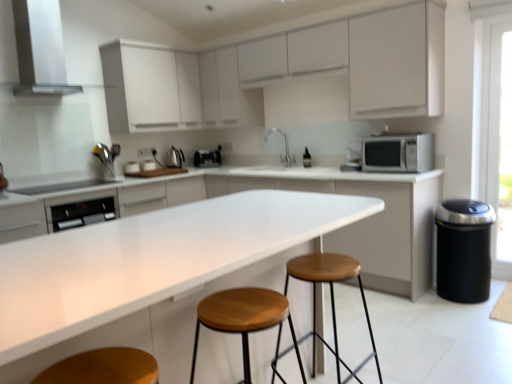
Where is `free space to the left of black matte trash can at lower right, the first appliance ordered from the bottom`? The image size is (512, 384). free space to the left of black matte trash can at lower right, the first appliance ordered from the bottom is located at coordinates (424, 302).